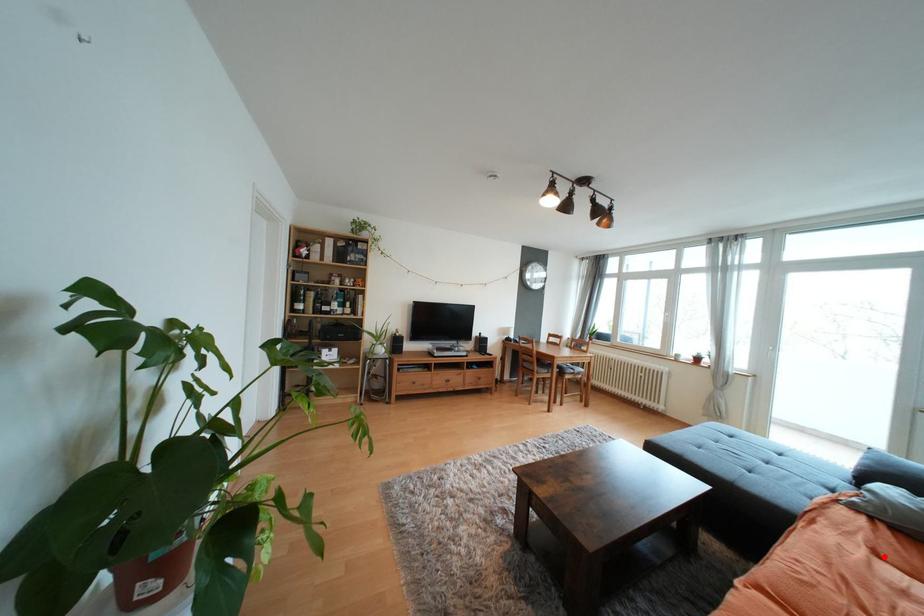
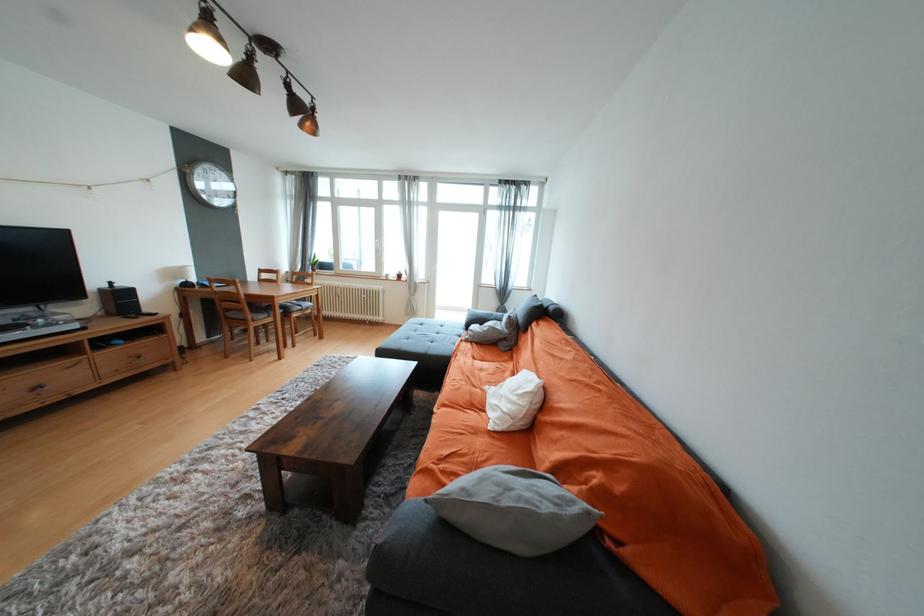
Locate, in the second image, the point that corresponds to the highlighted location in the first image.

(480, 360)